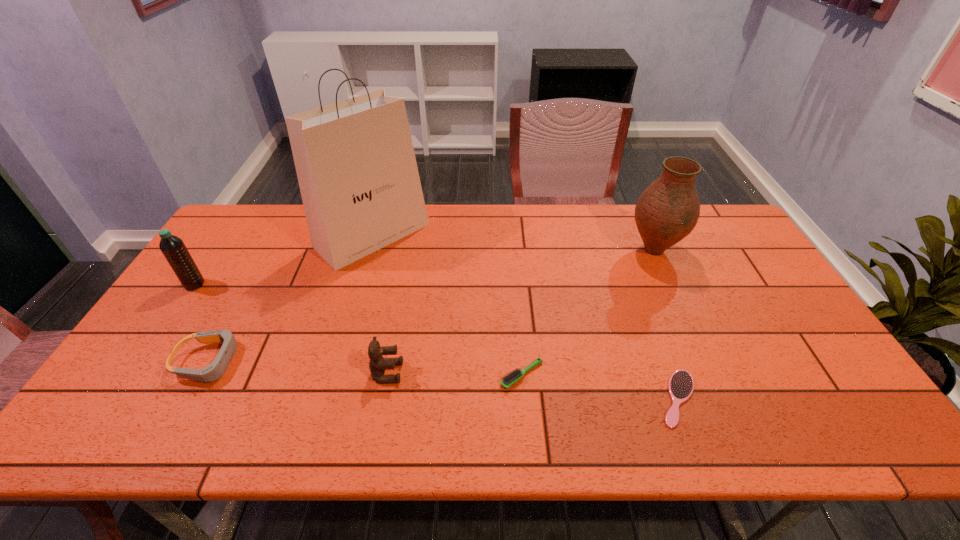
Find the location of a particular element. This screenshot has width=960, height=540. free spot located on the front of the vase is located at coordinates (687, 325).

Where is `free spot located 0.350m on the back of the water bottle`? The height and width of the screenshot is (540, 960). free spot located 0.350m on the back of the water bottle is located at coordinates (244, 212).

The height and width of the screenshot is (540, 960). Identify the location of vacant space located on the face of the teddy bear. (547, 373).

The height and width of the screenshot is (540, 960). In order to click on free space located on the front and back of the fifth tallest object in this screenshot , I will do `click(280, 361)`.

Find the location of a particular element. vacant space located 0.080m on the front of the fifth object from left to right is located at coordinates (525, 421).

Identify the location of blank space located 0.320m on the right of the right hairbrush. (835, 398).

Where is `shopping bag located at the far edge`? The image size is (960, 540). shopping bag located at the far edge is located at coordinates (355, 162).

This screenshot has height=540, width=960. I want to click on vase positioned at the far edge, so click(667, 211).

The width and height of the screenshot is (960, 540). What are the coordinates of `object at the near edge` in the screenshot? It's located at (681, 383).

You are a GUI agent. You are given a task and a screenshot of the screen. Output one action in this format:
    pyautogui.click(x=<x>, y=<y>)
    Task: Click on the water bottle situated at the left edge
    The image size is (960, 540).
    Given the screenshot: What is the action you would take?
    pyautogui.click(x=173, y=248)